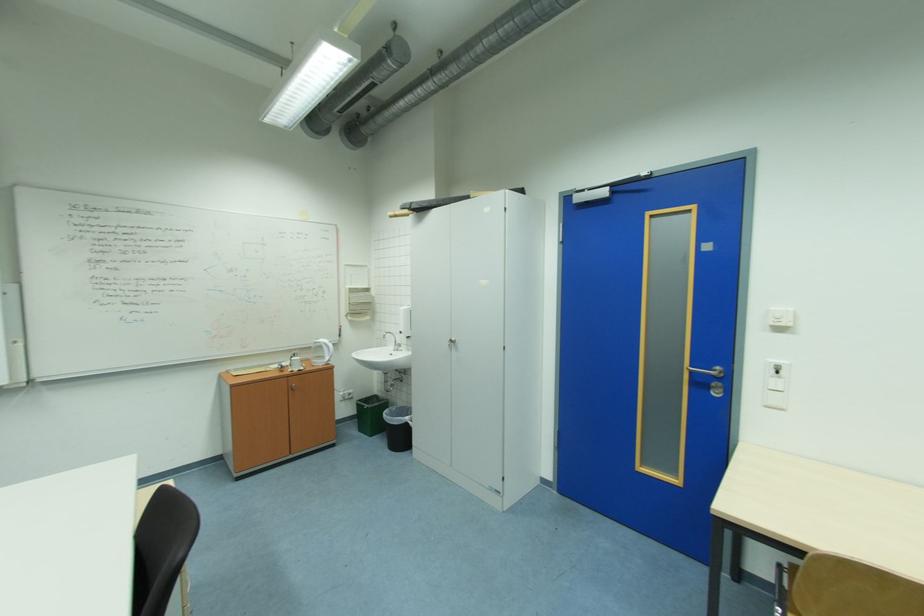
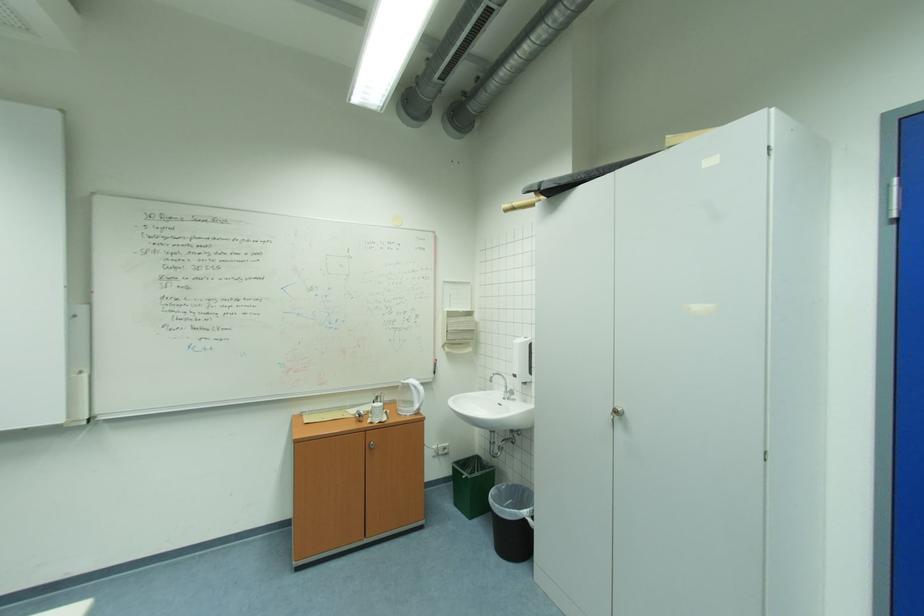
The point at (x=397, y=349) is marked in the first image. Where is the corresponding point in the second image?

(506, 394)